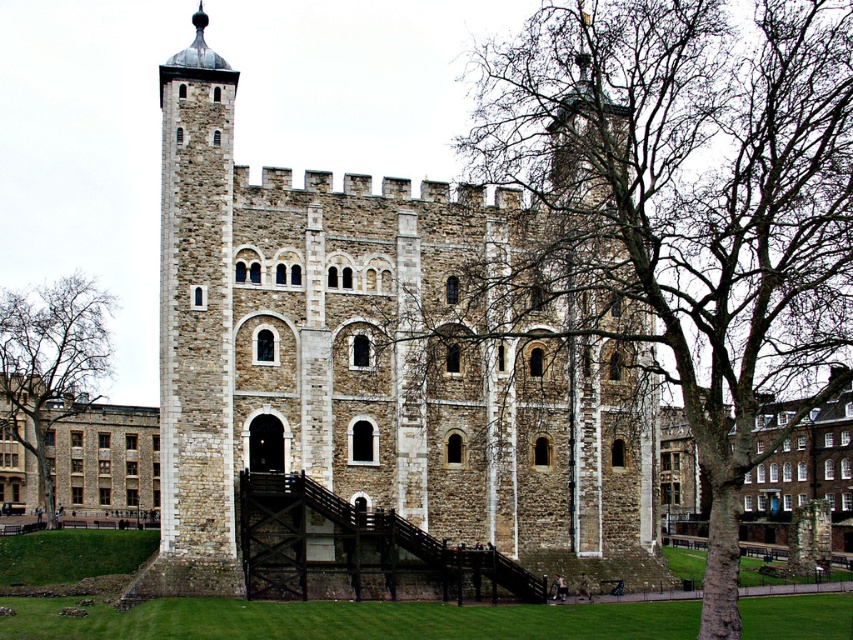
You are an architect analyzing the layout of this historic building. Based on the image, which stone tower is located higher up in the structure, the stone tower at center or the stone tower at left?

The stone tower at center is positioned under the stone tower at left, meaning the stone tower at left is higher up in the structure.

You are standing in front of the historic stone building and want to enter the nearest tower. Which tower should you approach, the stone tower at center or the stone tower at left?

You should approach the stone tower at center because it is closer to the viewer than the stone tower at left.

You are an architect examining this historic building. You notice two stone towers in the image. Which tower is taller, the stone tower at center or the stone tower at left?

The stone tower at center is much taller than the stone tower at left.